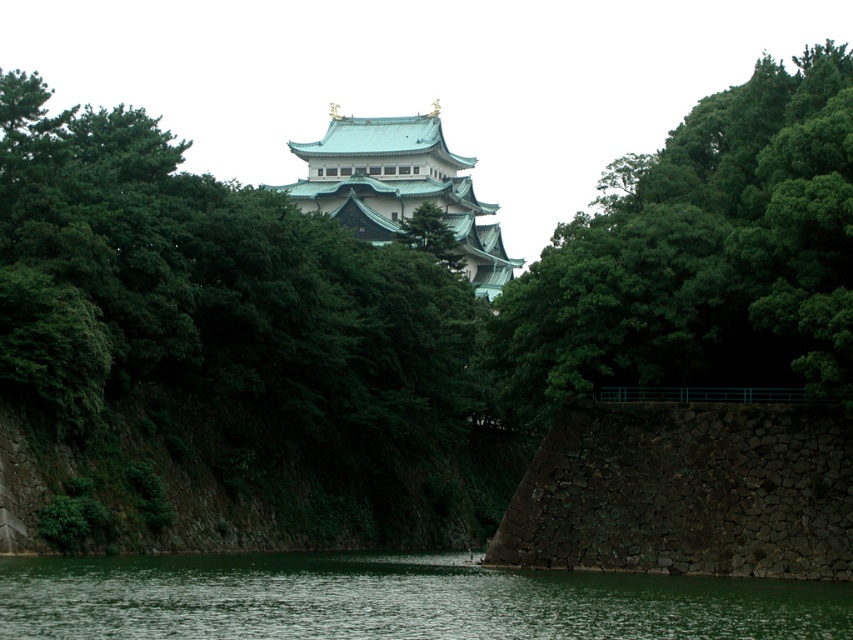
Question: Estimate the real-world distances between objects in this image. Which object is closer to the green stone river at lower center?

Choices:
 (A) green leafy tree at upper center
 (B) teal glazed tower at center

Answer: (A)

Question: Which point is closer to the camera?

Choices:
 (A) (199, 628)
 (B) (628, 372)
 (C) (440, 145)

Answer: (A)

Question: Is the position of green leafy tree at upper center less distant than that of teal glazed tower at center?

Choices:
 (A) yes
 (B) no

Answer: (A)

Question: Does green leafy tree at upper center have a smaller size compared to green stone river at lower center?

Choices:
 (A) no
 (B) yes

Answer: (A)

Question: Which point is closer to the camera?

Choices:
 (A) (293, 145)
 (B) (833, 76)
 (C) (618, 620)

Answer: (C)

Question: Does green leafy tree at upper center have a larger size compared to green stone river at lower center?

Choices:
 (A) yes
 (B) no

Answer: (A)